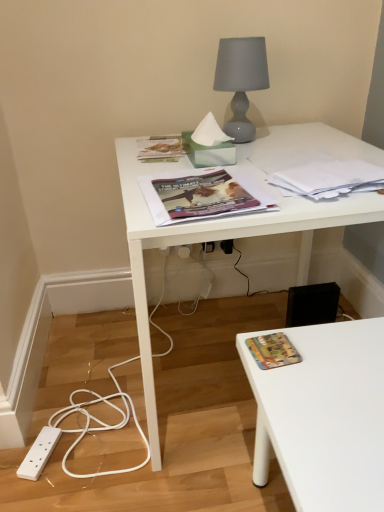
This screenshot has width=384, height=512. Identify the location of free space to the left of white plastic power plugs and sockets at lower left. (18, 454).